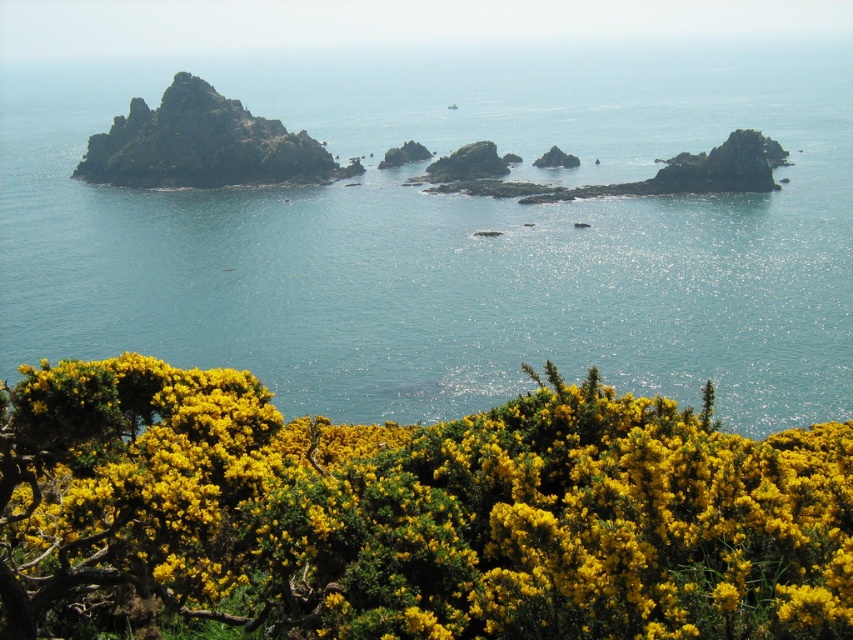
You are a photographer planning to capture the coastal landscape. You want to ensure that the clear blue water at center and the yellow textured bush at lower center are both in focus. Given that your camera can only focus on objects within a 2 meter width, will both fit within this range?

The clear blue water at center is wider than the yellow textured bush at lower center. Since the camera can focus on objects within a 2 meter width, and the water is wider, it depends on the exact widths. However, the description only states the water is wider, not the specific measurements. Without exact dimensions, it is uncertain if both will fit within the 2 meter focus range.

You are standing at the edge of the coastal landscape and want to place a small flag at each of the two points marked in the image. Which point, point (374, 369) or point (206, 161), will appear closer to you when viewed from your current position?

Point (374, 369) is closer to the viewer than point (206, 161), so the flag placed there will appear closer when viewed from your current position.